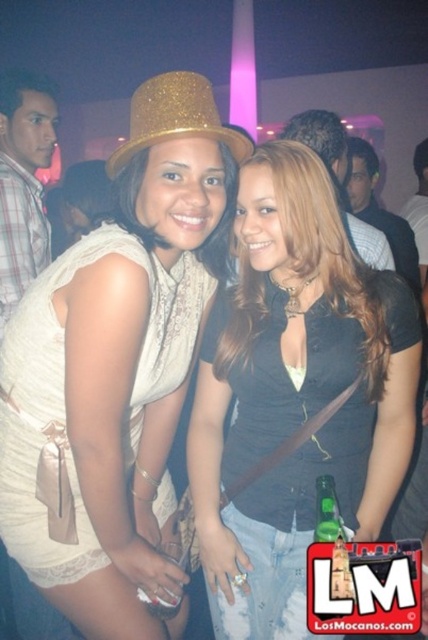
Does matte black top at center appear over gold glittery hat at center?

No.

Is point (321, 314) in front of point (145, 145)?

No, (321, 314) is further to viewer.

Where is `matte black top at center`? matte black top at center is located at coordinates (296, 392).

Can you confirm if matte gold glitter hat at center is positioned below matte black top at center?

Incorrect, matte gold glitter hat at center is not positioned below matte black top at center.

This screenshot has height=640, width=428. Describe the element at coordinates (121, 362) in the screenshot. I see `matte gold glitter hat at center` at that location.

Locate an element on the screen. matte gold glitter hat at center is located at coordinates (121, 362).

Can you confirm if matte gold glitter hat at center is positioned below gold glittery hat at center?

Indeed, matte gold glitter hat at center is positioned under gold glittery hat at center.

Who is more forward, (92,433) or (166,88)?

Point (166,88) is in front.

Where is `matte gold glitter hat at center`? The width and height of the screenshot is (428, 640). matte gold glitter hat at center is located at coordinates (121, 362).